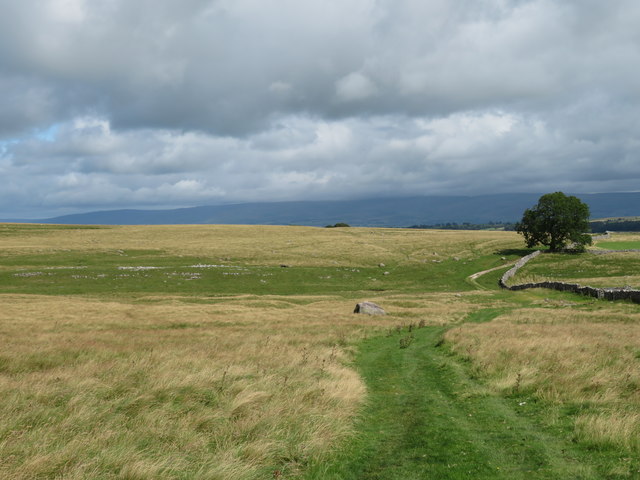
Find the location of `right side of stone wall`. right side of stone wall is located at coordinates (508, 271).